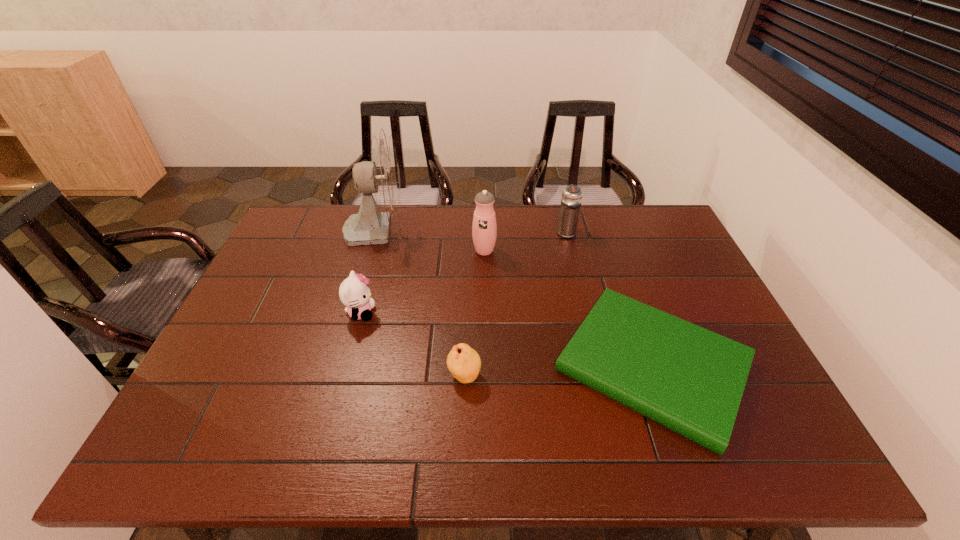
Locate an element on the screen. The height and width of the screenshot is (540, 960). free spot between the tallest object and the pear is located at coordinates (420, 302).

At what (x,y) coordinates should I click in order to perform the action: click on free space that is in between the fifth tallest object and the taller thermos bottle. Please return your answer as a coordinate pair (x, y). The image size is (960, 540). Looking at the image, I should click on (474, 313).

I want to click on free space between the pear and the right thermos bottle, so click(516, 303).

Locate an element on the screen. free spot between the left thermos bottle and the pear is located at coordinates (474, 313).

Locate an element on the screen. This screenshot has height=540, width=960. object that can be found as the fourth closest to the paperback book is located at coordinates (354, 292).

This screenshot has width=960, height=540. What are the coordinates of `object that can be found as the fourth closest to the pear` in the screenshot? It's located at (381, 176).

This screenshot has width=960, height=540. Identify the location of blank area in the image that satisfies the following two spatial constraints: 1. on the back side of the paperback book; 2. in front of the fan to blow air. (604, 229).

Where is `free space that satisfies the following two spatial constraints: 1. on the front side of the taller thermos bottle; 2. on the front-facing side of the third shortest object`? free space that satisfies the following two spatial constraints: 1. on the front side of the taller thermos bottle; 2. on the front-facing side of the third shortest object is located at coordinates tap(485, 313).

Locate an element on the screen. vacant region that satisfies the following two spatial constraints: 1. in front of the taller thermos bottle to blow air; 2. on the left side of the tallest object is located at coordinates (370, 251).